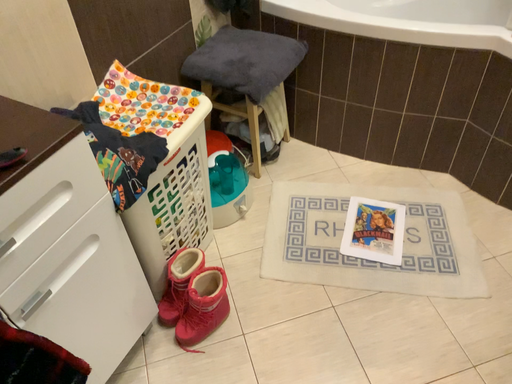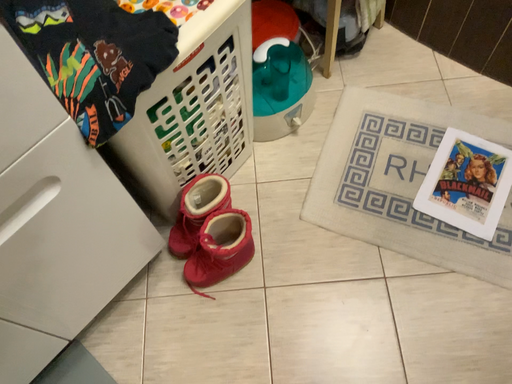
Question: How did the camera likely rotate when shooting the video?

Choices:
 (A) rotated left
 (B) rotated right

Answer: (A)